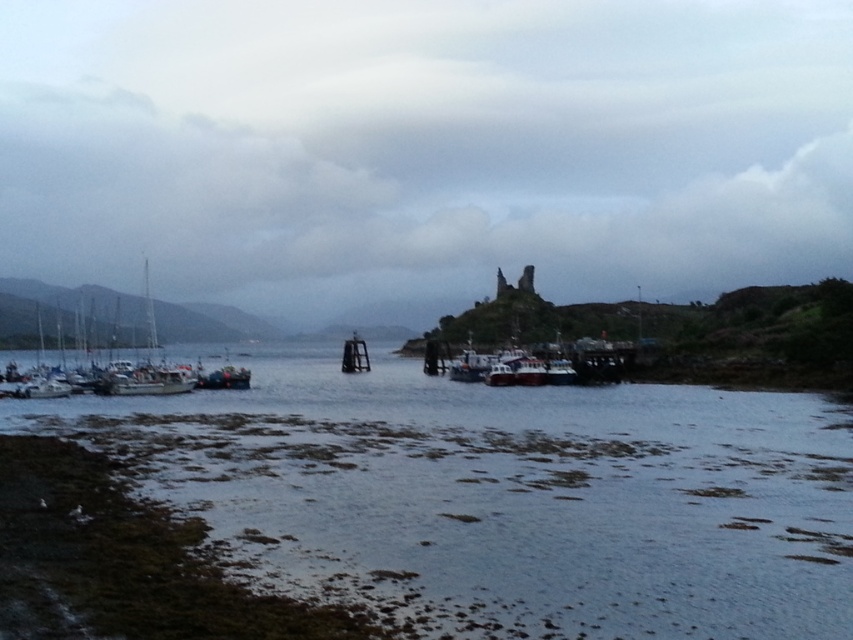
Question: Which point is farther to the camera?

Choices:
 (A) white matte sailboat at left
 (B) smooth water at center
 (C) black matte dock at center

Answer: (C)

Question: Estimate the real-world distances between objects in this image. Which object is farther from the black matte dock at center?

Choices:
 (A) smooth water at center
 (B) white matte sailboat at left

Answer: (A)

Question: Which point is farther to the camera?

Choices:
 (A) smooth water at center
 (B) black matte dock at center

Answer: (B)

Question: Can you confirm if smooth water at center is positioned above white matte sailboat at left?

Choices:
 (A) yes
 (B) no

Answer: (B)

Question: Can you confirm if smooth water at center is positioned below black matte dock at center?

Choices:
 (A) no
 (B) yes

Answer: (B)

Question: Is smooth water at center to the right of white matte sailboat at left from the viewer's perspective?

Choices:
 (A) no
 (B) yes

Answer: (B)